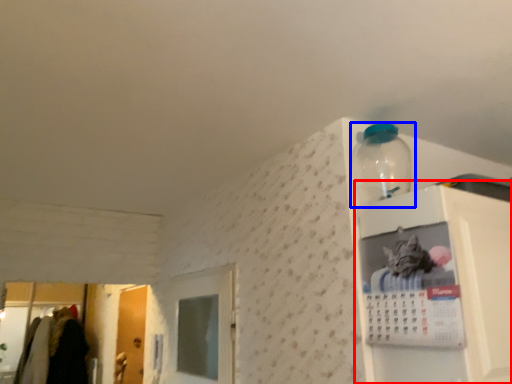
Question: Which object appears closest to the camera in this image, cabinet (highlighted by a red box) or bottle (highlighted by a blue box)?

Choices:
 (A) cabinet
 (B) bottle

Answer: (A)